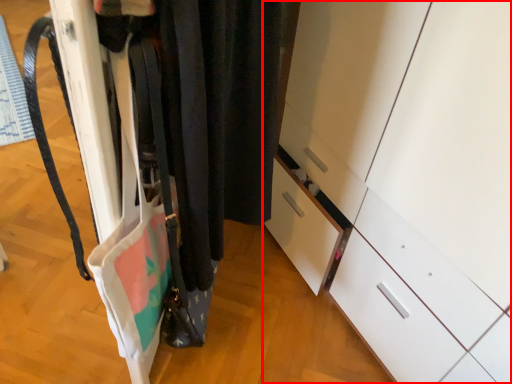
Question: From the image's perspective, what is the correct spatial positioning of cabinetry (annotated by the red box) in reference to closet?

Choices:
 (A) above
 (B) below

Answer: (B)